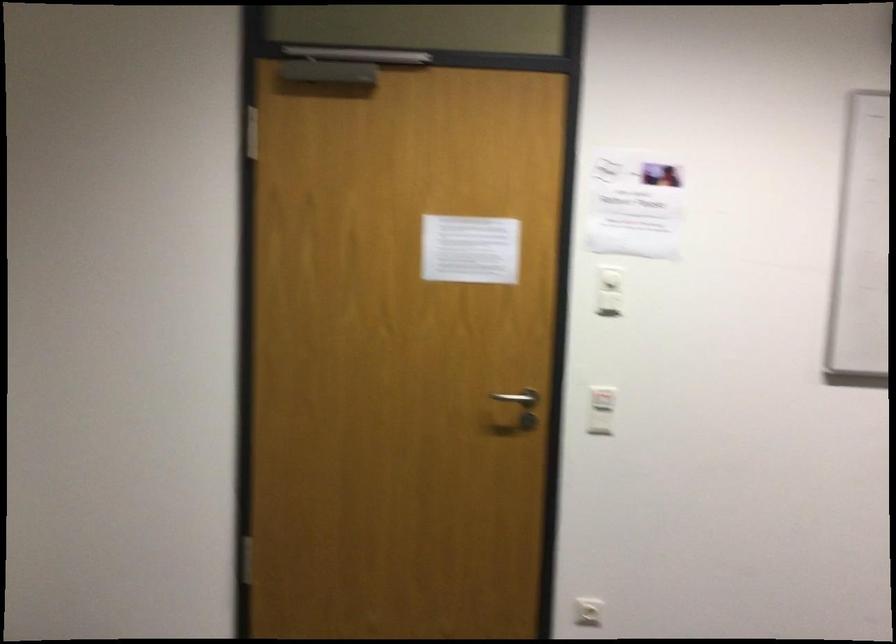
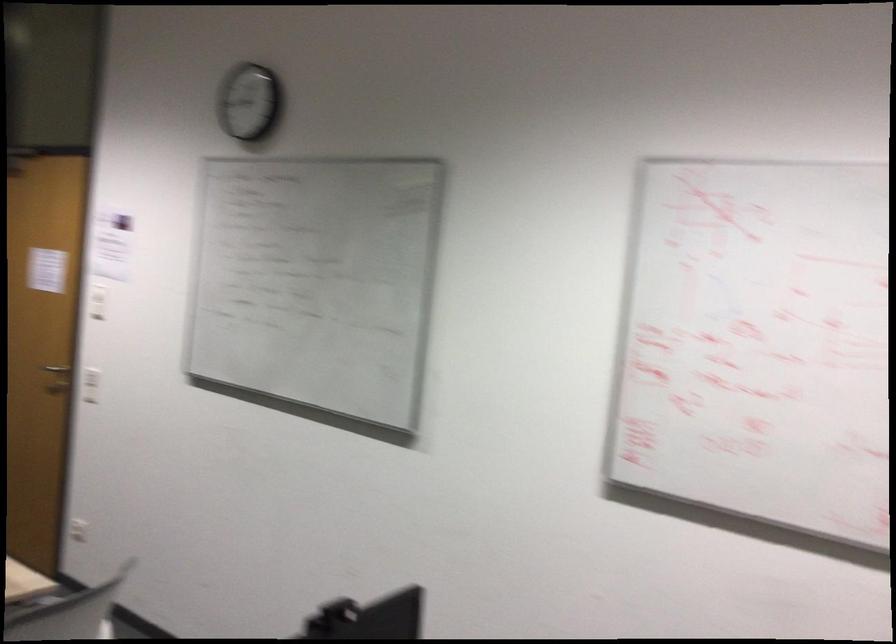
Where in the second image is the point corresponding to point (407, 406) from the first image?

(56, 368)